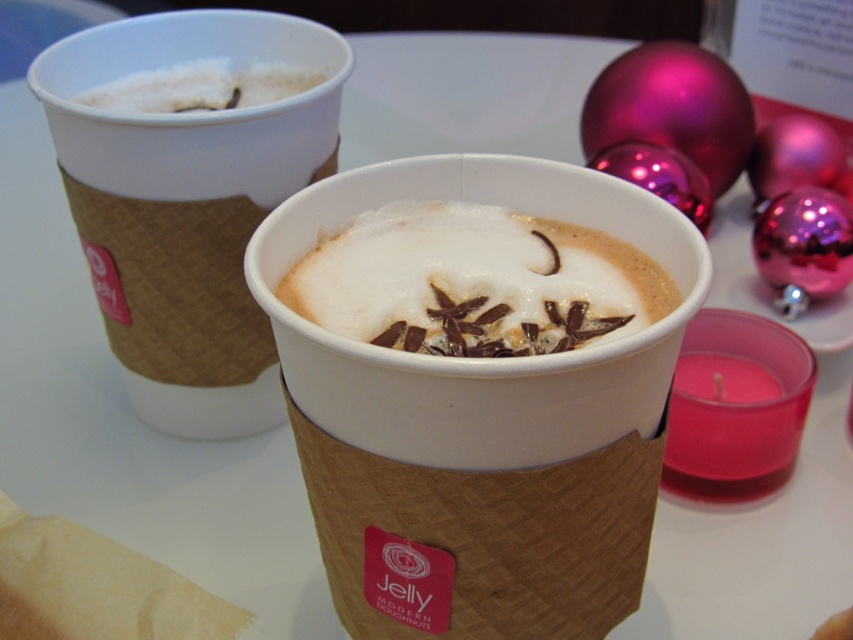
Question: Does white foam coffee at upper left appear over white frothy foam at upper left?

Choices:
 (A) no
 (B) yes

Answer: (A)

Question: Which point is closer to the camera?

Choices:
 (A) tap(440, 252)
 (B) tap(177, 100)

Answer: (A)

Question: Does white foam coffee at upper left have a greater width compared to white frothy foam at upper left?

Choices:
 (A) yes
 (B) no

Answer: (A)

Question: Which point is farther to the camera?

Choices:
 (A) white foam coffee at upper left
 (B) white frothy foam at upper left
 (C) white frothy foam at center

Answer: (B)

Question: Is white foam coffee at upper left positioned before white frothy foam at center?

Choices:
 (A) no
 (B) yes

Answer: (A)

Question: Which point appears closest to the camera in this image?

Choices:
 (A) (590, 296)
 (B) (234, 74)

Answer: (A)